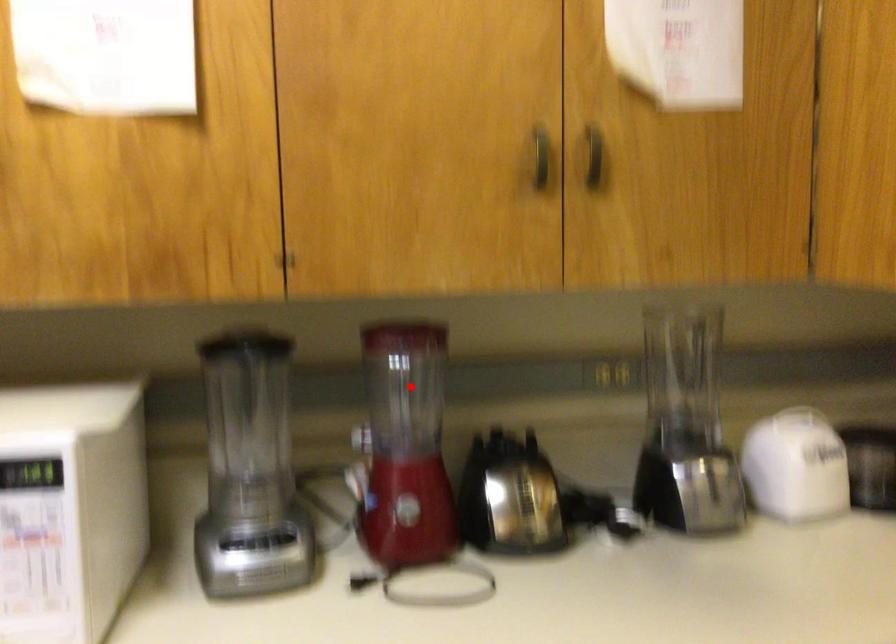
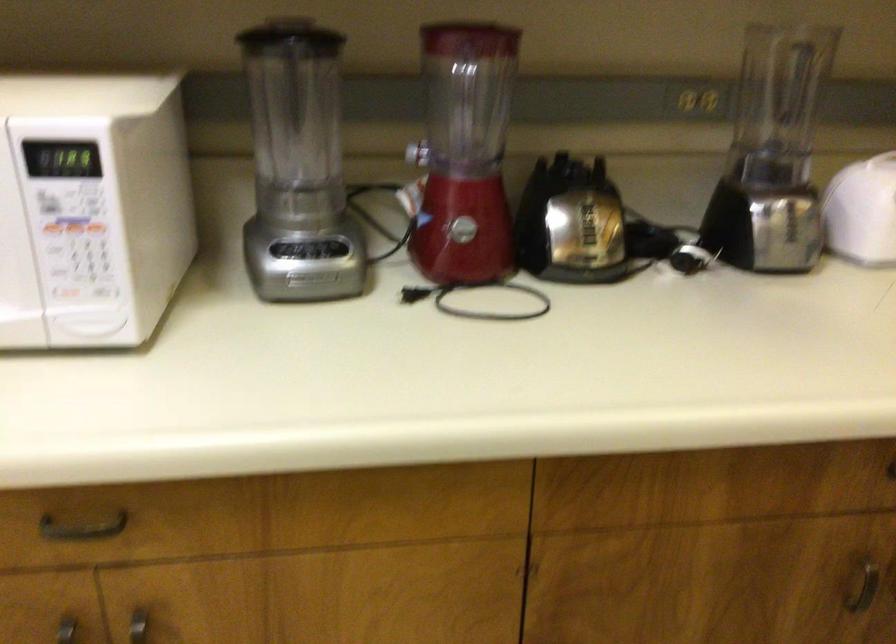
Where in the second image is the point corresponding to the highlighted location from the first image?

(467, 93)